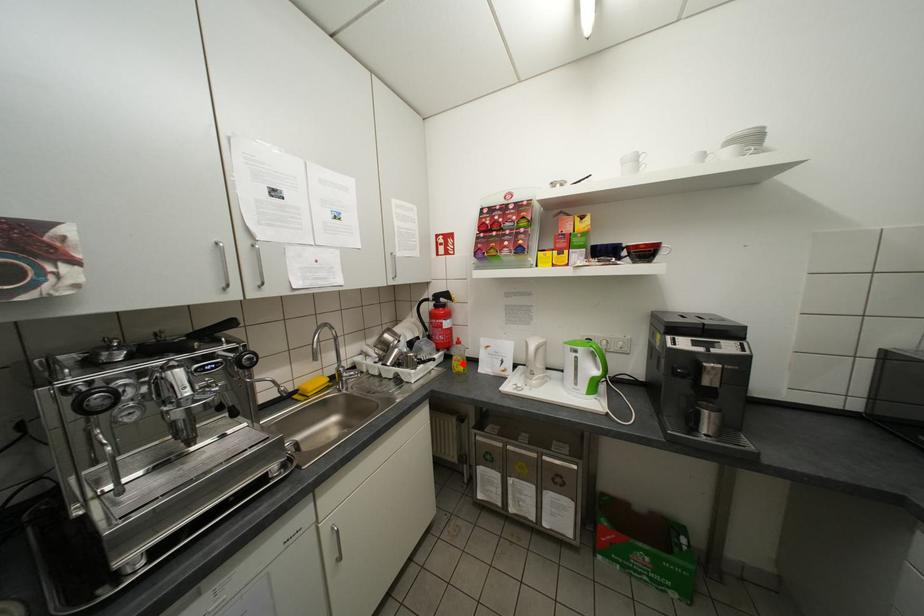
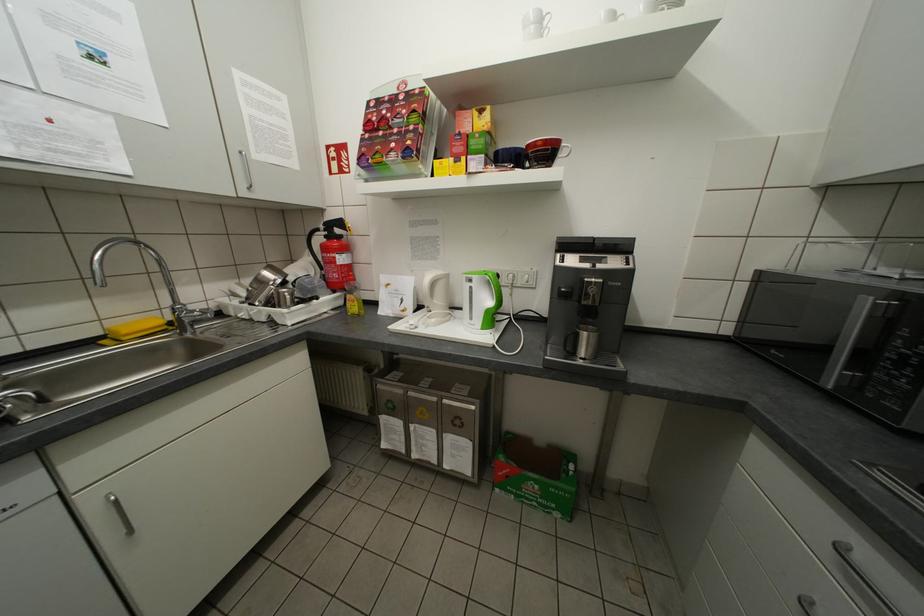
Where in the second image is the point corresponding to the highlighted location from the first image?

(357, 305)